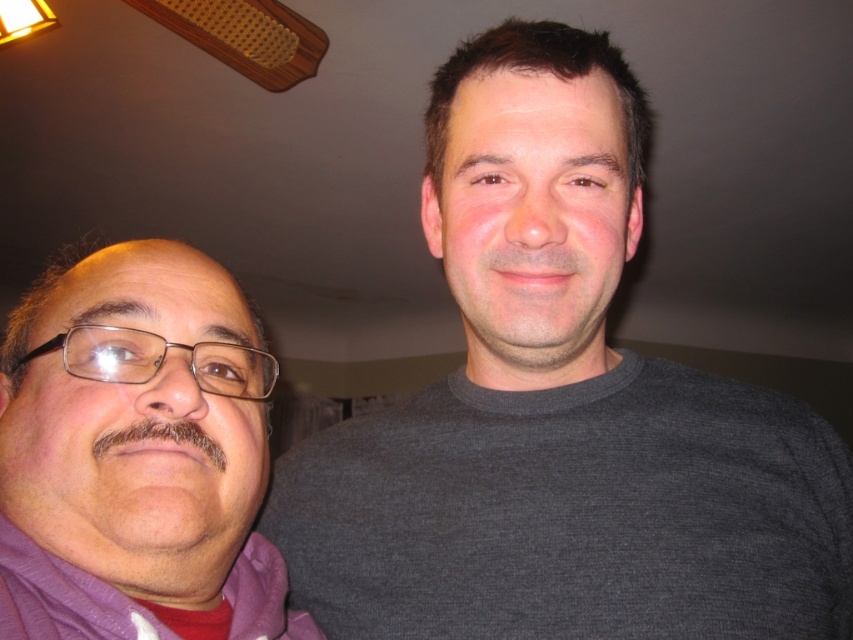
Question: Is gray matte sweater at center further to the viewer compared to purple fabric at left?

Choices:
 (A) no
 (B) yes

Answer: (B)

Question: Which point is closer to the camera?

Choices:
 (A) (112, 317)
 (B) (560, 348)

Answer: (A)

Question: Among these objects, which one is farthest from the camera?

Choices:
 (A) purple fabric at left
 (B) gray matte sweater at center

Answer: (B)

Question: Which point is closer to the camera?

Choices:
 (A) purple fabric at left
 (B) gray matte sweater at center

Answer: (A)

Question: Is gray matte sweater at center wider than purple fabric at left?

Choices:
 (A) yes
 (B) no

Answer: (A)

Question: Does gray matte sweater at center appear on the right side of purple fabric at left?

Choices:
 (A) yes
 (B) no

Answer: (A)